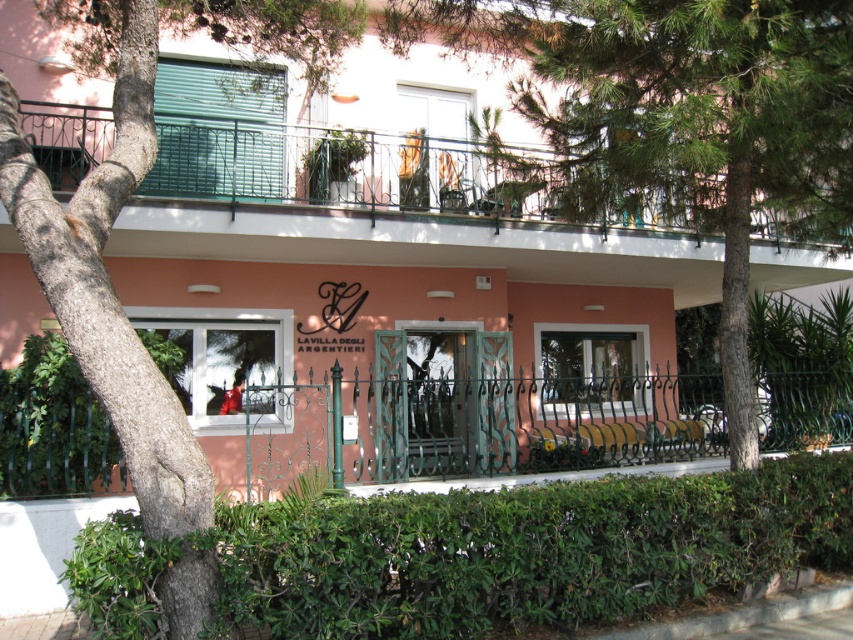
Question: From the image, what is the correct spatial relationship of metallic railing at upper center in relation to green leafy hedge at lower left?

Choices:
 (A) below
 (B) above

Answer: (B)

Question: Is metallic railing at upper center to the right of green leafy hedge at lower left from the viewer's perspective?

Choices:
 (A) no
 (B) yes

Answer: (B)

Question: Among these points, which one is nearest to the camera?

Choices:
 (A) (128, 579)
 (B) (519, 218)

Answer: (A)

Question: Which point is closer to the camera?

Choices:
 (A) green leafy hedge at lower left
 (B) green leafy hedge at lower center
 (C) metallic railing at upper center
 (D) green textured bark at left

Answer: (B)

Question: Which point is closer to the camera taking this photo?

Choices:
 (A) (115, 324)
 (B) (711, 483)
 (C) (212, 170)

Answer: (A)

Question: From the image, what is the correct spatial relationship of green leafy hedge at lower center in relation to green leafy hedge at lower left?

Choices:
 (A) below
 (B) above

Answer: (A)